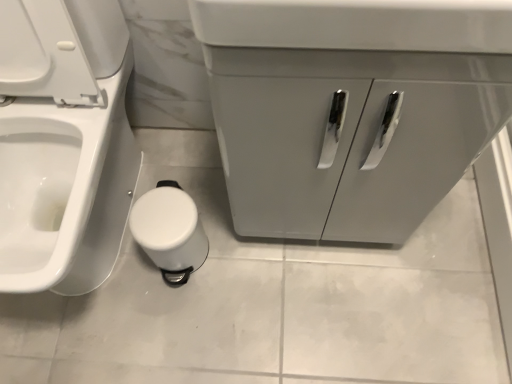
At what (x,y) coordinates should I click in order to perform the action: click on vacant space to the right of white plastic toilet paper at lower center. Please return your answer as a coordinate pair (x, y). Looking at the image, I should click on (234, 261).